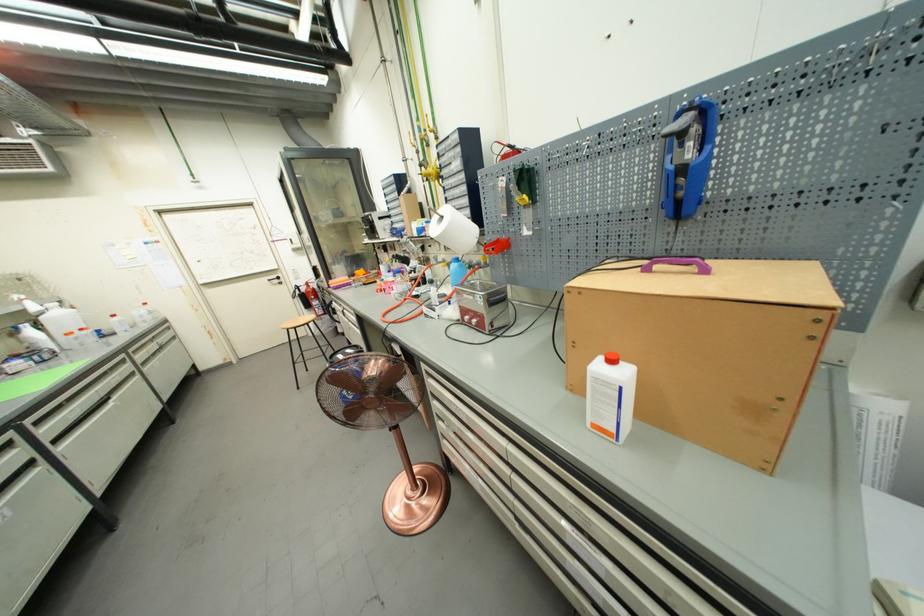
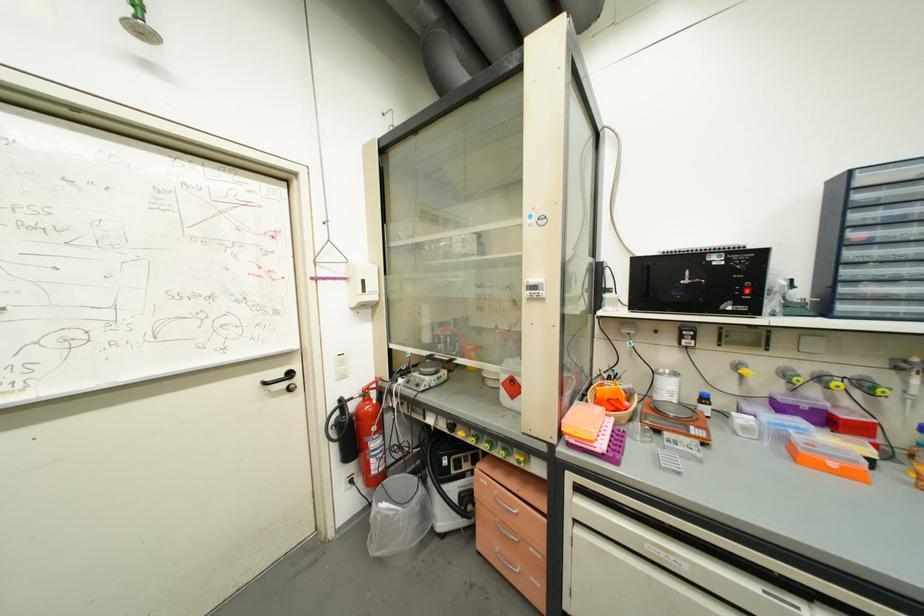
Where in the second image is the point corresponding to (x=309, y=291) from the first image?

(358, 408)